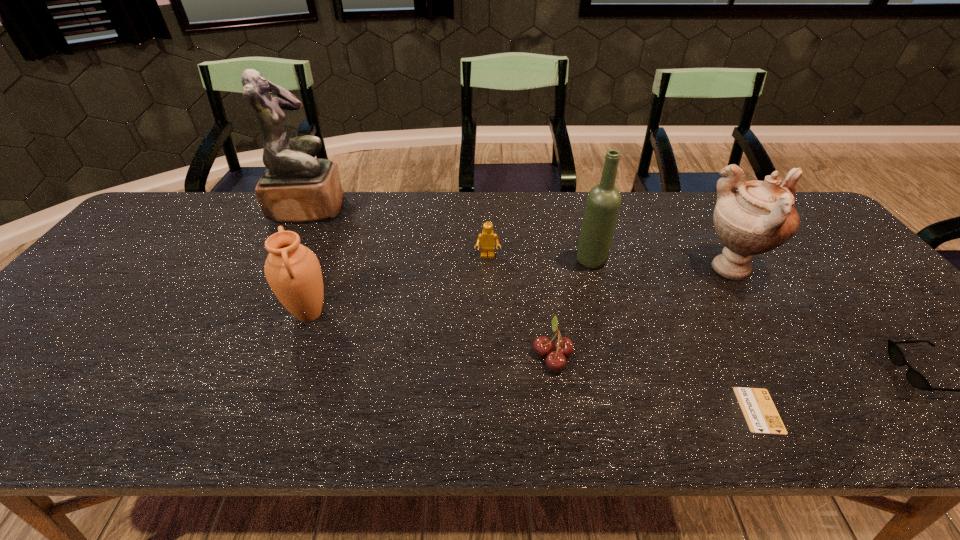
Identify the location of sculpture. The width and height of the screenshot is (960, 540). (296, 187).

Image resolution: width=960 pixels, height=540 pixels. In order to click on the tallest object in this screenshot , I will do (x=296, y=187).

Where is `the fourth object from right to left`? the fourth object from right to left is located at coordinates (603, 202).

Identify the location of the right urn. The height and width of the screenshot is (540, 960). (758, 217).

Where is `the shorter urn`? the shorter urn is located at coordinates (293, 272).

The height and width of the screenshot is (540, 960). Identify the location of the left urn. (293, 272).

The image size is (960, 540). I want to click on Lego, so click(487, 239).

The image size is (960, 540). What are the coordinates of `the fourth shortest object` in the screenshot? It's located at (487, 239).

The width and height of the screenshot is (960, 540). Find the location of `cherry`. cherry is located at coordinates (556, 360).

The height and width of the screenshot is (540, 960). Identify the location of the fourth object from left to right. (556, 360).